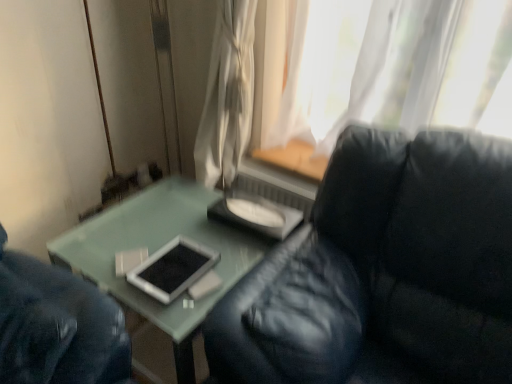
Measure the distance between point (214, 42) and camera.

Point (214, 42) is 1.58 meters away from camera.

The width and height of the screenshot is (512, 384). Describe the element at coordinates (227, 95) in the screenshot. I see `white sheer curtain at upper center` at that location.

I want to click on white sheer curtain at upper center, so click(227, 95).

At what (x,y) coordinates should I click in order to perform the action: click on black leather couch at center. Please return your answer as a coordinate pair (x, y). This screenshot has width=512, height=384. Looking at the image, I should click on (384, 271).

Image resolution: width=512 pixels, height=384 pixels. What do you see at coordinates (384, 271) in the screenshot?
I see `black leather couch at center` at bounding box center [384, 271].

The image size is (512, 384). What are the coordinates of `white sheer curtain at upper center` in the screenshot? It's located at (227, 95).

Which object is positioned more to the left, black leather couch at center or white sheer curtain at upper center?

white sheer curtain at upper center.

Is the position of black leather couch at center more distant than that of white sheer curtain at upper center?

That is False.

Is point (438, 364) less distant than point (246, 1)?

Yes.

In the scene shown: From the image's perspective, is black leather couch at center located above or below white sheer curtain at upper center?

Clearly, from the image's perspective, black leather couch at center is below white sheer curtain at upper center.

In the scene shown: From a real-world perspective, does black leather couch at center sit lower than white sheer curtain at upper center?

Yes, from a real-world perspective, black leather couch at center is under white sheer curtain at upper center.

Can you confirm if black leather couch at center is wider than white sheer curtain at upper center?

Indeed, black leather couch at center has a greater width compared to white sheer curtain at upper center.

Which of these two, black leather couch at center or white sheer curtain at upper center, stands shorter?

white sheer curtain at upper center is shorter.

In terms of size, does black leather couch at center appear bigger or smaller than white sheer curtain at upper center?

Considering their sizes, black leather couch at center takes up more space than white sheer curtain at upper center.

Is black leather couch at center completely or partially outside of white sheer curtain at upper center?

Yes, black leather couch at center is outside of white sheer curtain at upper center.

Does black leather couch at center touch white sheer curtain at upper center?

black leather couch at center and white sheer curtain at upper center are not in contact.

Is white sheer curtain at upper center at the back of black leather couch at center?

black leather couch at center does not have its back to white sheer curtain at upper center.

The width and height of the screenshot is (512, 384). I want to click on studio couch on the right side of white sheer curtain at upper center, so click(384, 271).

Visually, is white sheer curtain at upper center positioned to the left or to the right of black leather couch at center?

Based on their positions, white sheer curtain at upper center is located to the left of black leather couch at center.

Based on the photo, considering their positions, is white sheer curtain at upper center located in front of or behind black leather couch at center?

white sheer curtain at upper center is positioned farther from the viewer than black leather couch at center.

Does point (231, 63) come farther from viewer compared to point (401, 299)?

That is True.

From the image's perspective, is white sheer curtain at upper center beneath black leather couch at center?

Actually, white sheer curtain at upper center appears above black leather couch at center in the image.

From a real-world perspective, is white sheer curtain at upper center physically located above or below black leather couch at center?

From a real-world perspective, white sheer curtain at upper center is physically above black leather couch at center.

Consider the image. Which of these two, white sheer curtain at upper center or black leather couch at center, is thinner?

With smaller width is white sheer curtain at upper center.

Can you confirm if white sheer curtain at upper center is shorter than black leather couch at center?

Indeed, white sheer curtain at upper center has a lesser height compared to black leather couch at center.

Can you confirm if white sheer curtain at upper center is bigger than black leather couch at center?

Actually, white sheer curtain at upper center might be smaller than black leather couch at center.

Is white sheer curtain at upper center spatially inside black leather couch at center, or outside of it?

white sheer curtain at upper center is not inside black leather couch at center, it's outside.

Is white sheer curtain at upper center next to black leather couch at center?

No.

Could you tell me if white sheer curtain at upper center is turned towards black leather couch at center?

No, white sheer curtain at upper center is not turned towards black leather couch at center.

What's the angular difference between white sheer curtain at upper center and black leather couch at center's facing directions?

They differ by 1.25 degrees in their facing directions.

What are the coordinates of `curtain located above the black leather couch at center (from the image's perspective)` in the screenshot? It's located at [x=227, y=95].

Identify the location of studio couch in front of the white sheer curtain at upper center. The width and height of the screenshot is (512, 384). (384, 271).

Find the location of `curtain above the black leather couch at center (from a real-world perspective)`. curtain above the black leather couch at center (from a real-world perspective) is located at coordinates (227, 95).